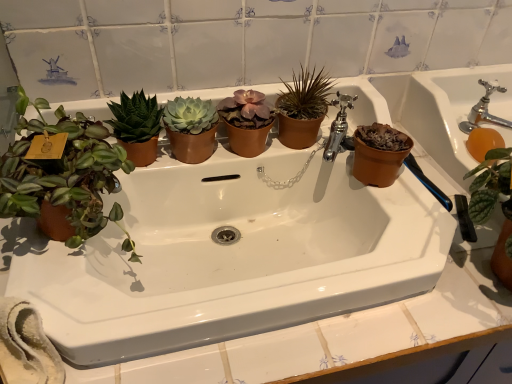
Image resolution: width=512 pixels, height=384 pixels. What do you see at coordinates (137, 126) in the screenshot? I see `green matte succulent at upper center, the second houseplant in the left-to-right sequence` at bounding box center [137, 126].

Describe the element at coordinates (338, 126) in the screenshot. The height and width of the screenshot is (384, 512). I see `chrome metallic faucet at upper center, the 2th tap in the right-to-left sequence` at that location.

Measure the distance between brown terracotta pot at right and camera.

They are 28.81 inches apart.

Describe the element at coordinates (379, 154) in the screenshot. I see `brown terracotta pot at right` at that location.

Measure the distance between point (304,81) and camera.

Point (304,81) is 32.95 inches from camera.

You are a GUI agent. You are given a task and a screenshot of the screen. Output one action in this format:
    pyautogui.click(x=<x>, y=<y>)
    Task: Click on the terracotta pot at right
    This screenshot has height=384, width=512.
    Given the screenshot: What is the action you would take?
    pyautogui.click(x=443, y=112)

The height and width of the screenshot is (384, 512). What do you see at coordinates (232, 255) in the screenshot?
I see `white ceramic sink at center` at bounding box center [232, 255].

Image resolution: width=512 pixels, height=384 pixels. What are the coordinates of `green matte succulent at upper center, the second houseplant in the left-to-right sequence` in the screenshot? It's located at (137, 126).

From a real-world perspective, does chrome metallic faucet at upper center, marked as the 1th tap in a left-to-right arrangement, stand above white ceramic sink at center?

Yes, from a real-world perspective, chrome metallic faucet at upper center, marked as the 1th tap in a left-to-right arrangement, is over white ceramic sink at center

From the image's perspective, which one is positioned higher, chrome metallic faucet at upper center, the 2th tap in the right-to-left sequence, or white ceramic sink at center?

From the image's view, chrome metallic faucet at upper center, the 2th tap in the right-to-left sequence, is above.

Is chrome metallic faucet at upper center, the 2th tap in the right-to-left sequence, taller than white ceramic sink at center?

No.

Considering the sizes of objects chrome metallic faucet at upper center, the 2th tap in the right-to-left sequence, and white ceramic sink at center in the image provided, who is thinner, chrome metallic faucet at upper center, the 2th tap in the right-to-left sequence, or white ceramic sink at center?

Thinner between the two is chrome metallic faucet at upper center, the 2th tap in the right-to-left sequence.

From the picture: Considering the sizes of objects brown terracotta pot at right and green matte succulent at upper center, positioned as the 2th houseplant in right-to-left order, in the image provided, who is wider, brown terracotta pot at right or green matte succulent at upper center, positioned as the 2th houseplant in right-to-left order,?

Wider between the two is green matte succulent at upper center, positioned as the 2th houseplant in right-to-left order.

Which is farther from the camera, [379,168] or [135,138]?

The point [379,168] is farther.

From the picture: Is brown terracotta pot at right directly adjacent to green matte succulent at upper center, the second houseplant in the left-to-right sequence?

brown terracotta pot at right and green matte succulent at upper center, the second houseplant in the left-to-right sequence, are clearly separated.

In the image, is brown terracotta pot at right positioned in front of or behind green matte succulent at upper center, the second houseplant in the left-to-right sequence?

brown terracotta pot at right is positioned farther from the viewer than green matte succulent at upper center, the second houseplant in the left-to-right sequence.

Is terracotta pot at right situated inside brown terracotta pot at right or outside?

terracotta pot at right cannot be found inside brown terracotta pot at right.

Is terracotta pot at right next to brown terracotta pot at right and touching it?

They are not placed beside each other.

Is terracotta pot at right bigger than brown terracotta pot at right?

Yes.

This screenshot has height=384, width=512. I want to click on bath on the right of the brown terracotta pot at right, so click(x=443, y=112).

Which object is further away from the camera taking this photo, brown matte pot at center, which appears as the 3th houseplant when viewed from the left, or brown terracotta pot at right?

brown matte pot at center, which appears as the 3th houseplant when viewed from the left, is more distant.

Which of these two, brown matte pot at center, which appears as the 3th houseplant when viewed from the left, or brown terracotta pot at right, stands shorter?

Standing shorter between the two is brown terracotta pot at right.

From the picture: How far apart are brown matte pot at center, marked as the first houseplant in a right-to-left arrangement, and brown terracotta pot at right?

5.48 inches.

From the picture: Can you see brown matte pot at center, which appears as the 3th houseplant when viewed from the left, touching brown terracotta pot at right?

No.

Which is behind, point (495, 105) or point (489, 115)?

The point (495, 105) is more distant.

Is terracotta pot at right next to silver metallic faucet at upper right, the second tap when ordered from left to right, and touching it?

terracotta pot at right and silver metallic faucet at upper right, the second tap when ordered from left to right, are clearly separated.

There is a terracotta pot at right. At what (x,y) coordinates should I click in order to perform the action: click on the 2nd tap above it (from a real-world perspective). Please return your answer as a coordinate pair (x, y). This screenshot has height=384, width=512. Looking at the image, I should click on (484, 110).

Is terracotta pot at right to the right of silver metallic faucet at upper right, the second tap when ordered from left to right, from the viewer's perspective?

Indeed, terracotta pot at right is positioned on the right side of silver metallic faucet at upper right, the second tap when ordered from left to right.

Which object is more forward, green matte succulent at upper center, positioned as the 2th houseplant in right-to-left order, or matte brown pot at left, the 1th houseplant from the left?

matte brown pot at left, the 1th houseplant from the left.

Looking at the image, does green matte succulent at upper center, positioned as the 2th houseplant in right-to-left order, seem bigger or smaller compared to matte brown pot at left, the third houseplant in the right-to-left sequence?

green matte succulent at upper center, positioned as the 2th houseplant in right-to-left order, is smaller than matte brown pot at left, the third houseplant in the right-to-left sequence.

Is green matte succulent at upper center, the second houseplant in the left-to-right sequence, looking in the opposite direction of matte brown pot at left, the third houseplant in the right-to-left sequence?

green matte succulent at upper center, the second houseplant in the left-to-right sequence, is not turned away from matte brown pot at left, the third houseplant in the right-to-left sequence.

What's the angular difference between green matte succulent at upper center, the second houseplant in the left-to-right sequence, and matte brown pot at left, the 1th houseplant from the left,'s facing directions?

The facing directions of green matte succulent at upper center, the second houseplant in the left-to-right sequence, and matte brown pot at left, the 1th houseplant from the left, are 0.00366 degrees apart.

Is terracotta pot at right completely or partially outside of chrome metallic faucet at upper center, marked as the 1th tap in a left-to-right arrangement?

Yes.

From a real-world perspective, is terracotta pot at right on top of chrome metallic faucet at upper center, marked as the 1th tap in a left-to-right arrangement?

No, from a real-world perspective, terracotta pot at right is not above chrome metallic faucet at upper center, marked as the 1th tap in a left-to-right arrangement.

From the picture: Is terracotta pot at right oriented towards chrome metallic faucet at upper center, marked as the 1th tap in a left-to-right arrangement?

No, terracotta pot at right is not turned towards chrome metallic faucet at upper center, marked as the 1th tap in a left-to-right arrangement.

Can you confirm if terracotta pot at right is taller than chrome metallic faucet at upper center, marked as the 1th tap in a left-to-right arrangement?

Yes.

You are a GUI agent. You are given a task and a screenshot of the screen. Output one action in this format:
    pyautogui.click(x=<x>, y=<y>)
    Task: Click on the sink below the chrome metallic faucet at upper center, the 2th tap in the right-to-left sequence (from a real-world perspective)
    Image resolution: width=512 pixels, height=384 pixels.
    Given the screenshot: What is the action you would take?
    pyautogui.click(x=232, y=255)

What are the coordinates of `flowerpot below the green matte succulent at upper center, the second houseplant in the left-to-right sequence (from the image's perspective)` in the screenshot? It's located at (379, 154).

Estimate the real-world distances between objects in this image. Which object is closer to terracotta pot at right, chrome metallic faucet at upper center, the 2th tap in the right-to-left sequence, or matte brown pot at left, the third houseplant in the right-to-left sequence?

chrome metallic faucet at upper center, the 2th tap in the right-to-left sequence, is closer to terracotta pot at right.

Considering their positions, is brown matte pot at center, marked as the first houseplant in a right-to-left arrangement, positioned closer to chrome metallic faucet at upper center, marked as the 1th tap in a left-to-right arrangement, than terracotta pot at right?

Based on the image, brown matte pot at center, marked as the first houseplant in a right-to-left arrangement, appears to be nearer to chrome metallic faucet at upper center, marked as the 1th tap in a left-to-right arrangement.

Considering their positions, is chrome metallic faucet at upper center, the 2th tap in the right-to-left sequence, positioned further to silver metallic faucet at upper right, the second tap when ordered from left to right, than matte brown pot at left, the 1th houseplant from the left?

matte brown pot at left, the 1th houseplant from the left, lies further to silver metallic faucet at upper right, the second tap when ordered from left to right, than the other object.

Which object lies nearer to the anchor point white ceramic sink at center, brown matte pot at center, which appears as the 3th houseplant when viewed from the left, or green matte succulent at upper center, the second houseplant in the left-to-right sequence?

brown matte pot at center, which appears as the 3th houseplant when viewed from the left, is closer to white ceramic sink at center.

Estimate the real-world distances between objects in this image. Which object is further from white ceramic sink at center, brown terracotta pot at right or chrome metallic faucet at upper center, marked as the 1th tap in a left-to-right arrangement?

chrome metallic faucet at upper center, marked as the 1th tap in a left-to-right arrangement, is further to white ceramic sink at center.

Estimate the real-world distances between objects in this image. Which object is further from brown terracotta pot at right, matte brown pot at left, the 1th houseplant from the left, or white ceramic sink at center?

Based on the image, matte brown pot at left, the 1th houseplant from the left, appears to be further to brown terracotta pot at right.

From the picture: Considering their positions, is matte brown pot at left, the 1th houseplant from the left, positioned further to brown matte pot at center, marked as the first houseplant in a right-to-left arrangement, than chrome metallic faucet at upper center, the 2th tap in the right-to-left sequence?

matte brown pot at left, the 1th houseplant from the left.

When comparing their distances from terracotta pot at right, does matte brown pot at left, the third houseplant in the right-to-left sequence, or green matte succulent at upper center, the second houseplant in the left-to-right sequence, seem further?

Among the two, matte brown pot at left, the third houseplant in the right-to-left sequence, is located further to terracotta pot at right.

This screenshot has height=384, width=512. In order to click on flowerpot located between matte brown pot at left, the third houseplant in the right-to-left sequence, and silver metallic faucet at upper right, which is the first tap in right-to-left order, in the left-right direction in this screenshot , I will do `click(379, 154)`.

You are a GUI agent. You are given a task and a screenshot of the screen. Output one action in this format:
    pyautogui.click(x=<x>, y=<y>)
    Task: Click on the flowerpot located between chrome metallic faucet at upper center, the 2th tap in the right-to-left sequence, and terracotta pot at right in the left-right direction
    This screenshot has width=512, height=384.
    Given the screenshot: What is the action you would take?
    pyautogui.click(x=379, y=154)

Locate an element on the screen. houseplant located between white ceramic sink at center and silver metallic faucet at upper right, the second tap when ordered from left to right, in the left-right direction is located at coordinates (303, 108).

The image size is (512, 384). In order to click on tap located between matte brown pot at left, the third houseplant in the right-to-left sequence, and silver metallic faucet at upper right, which is the first tap in right-to-left order, in the left-right direction in this screenshot , I will do `click(338, 126)`.